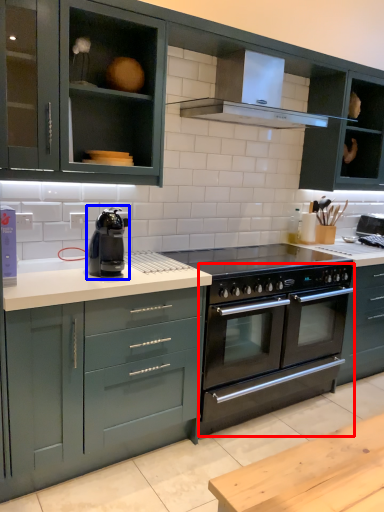
Question: Among these objects, which one is nearest to the camera, oven (highlighted by a red box) or home appliance (highlighted by a blue box)?

Choices:
 (A) oven
 (B) home appliance

Answer: (B)